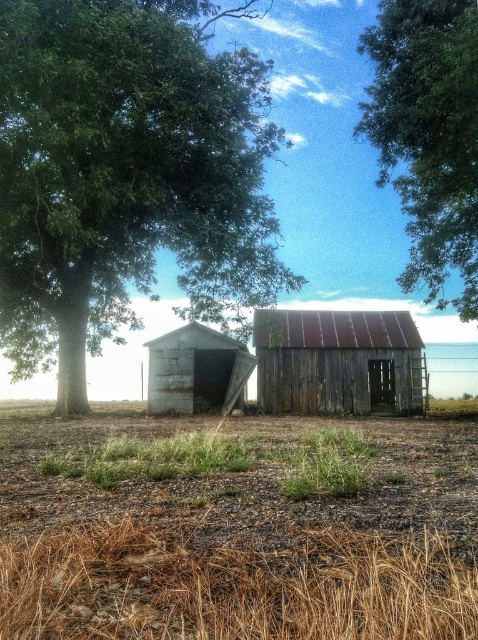
Is point (112, 10) positioned before point (401, 77)?

Yes, point (112, 10) is closer to viewer.

Is green leafy tree at left to the right of green leafy tree at upper center from the viewer's perspective?

In fact, green leafy tree at left is to the left of green leafy tree at upper center.

Locate an element on the screen. This screenshot has width=478, height=640. green leafy tree at left is located at coordinates (126, 173).

Which is more to the left, green leafy tree at left or weathered wood shed at center?

green leafy tree at left is more to the left.

Is green leafy tree at left thinner than weathered wood shed at center?

No, green leafy tree at left is not thinner than weathered wood shed at center.

What do you see at coordinates (126, 173) in the screenshot?
I see `green leafy tree at left` at bounding box center [126, 173].

Identify the location of green leafy tree at left. The height and width of the screenshot is (640, 478). [x=126, y=173].

Looking at this image, is brown soil at center shorter than green leafy tree at left?

Correct, brown soil at center is not as tall as green leafy tree at left.

Between point (304, 460) and point (188, 125), which one is positioned behind?

The point (188, 125) is more distant.

What do you see at coordinates (236, 529) in the screenshot?
I see `brown soil at center` at bounding box center [236, 529].

The width and height of the screenshot is (478, 640). Identify the location of brown soil at center. (236, 529).